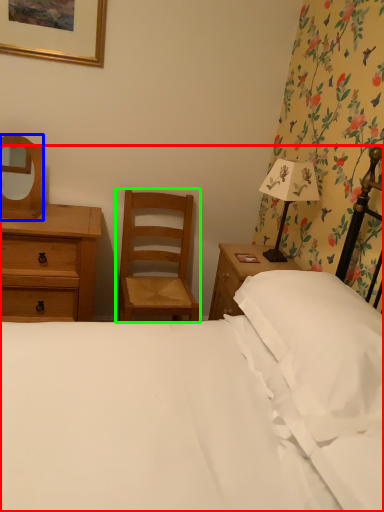
Question: Which is nearer to the bed (highlighted by a red box)? mirror (highlighted by a blue box) or chair (highlighted by a green box).

Choices:
 (A) mirror
 (B) chair

Answer: (B)